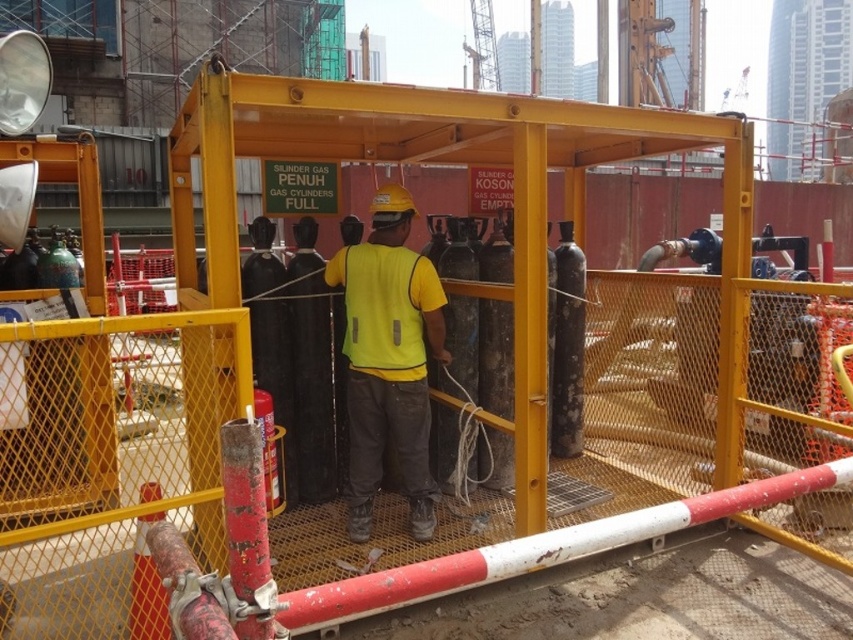
Question: Is the position of yellow reflective vest at center more distant than that of yellow matte safety vest at center?

Choices:
 (A) no
 (B) yes

Answer: (B)

Question: Which of the following is the closest to the observer?

Choices:
 (A) (404, 369)
 (B) (405, 348)

Answer: (A)

Question: Is yellow reflective vest at center bigger than yellow matte safety vest at center?

Choices:
 (A) yes
 (B) no

Answer: (A)

Question: Which point is closer to the camera?

Choices:
 (A) yellow matte safety vest at center
 (B) yellow reflective vest at center

Answer: (A)

Question: Can you confirm if yellow reflective vest at center is bigger than yellow matte safety vest at center?

Choices:
 (A) yes
 (B) no

Answer: (A)